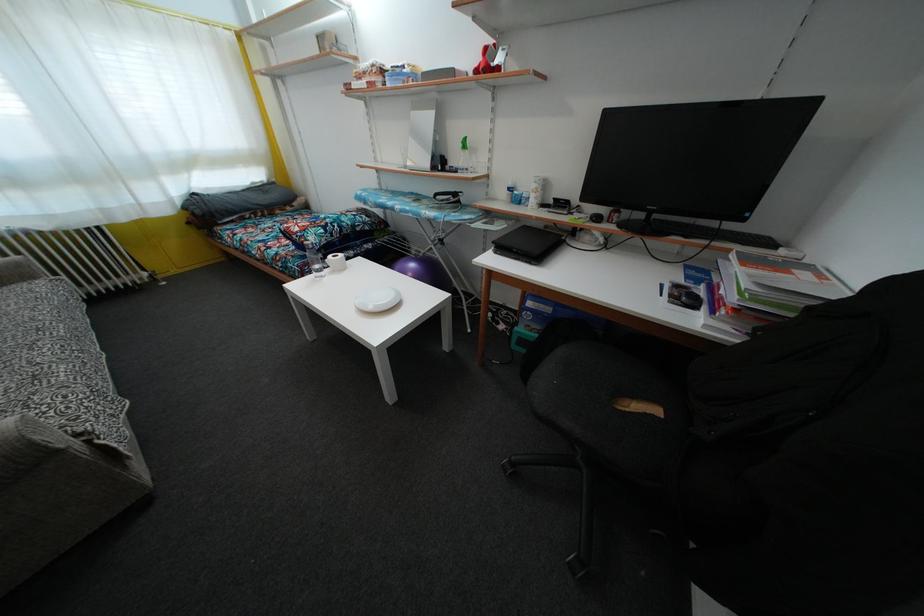
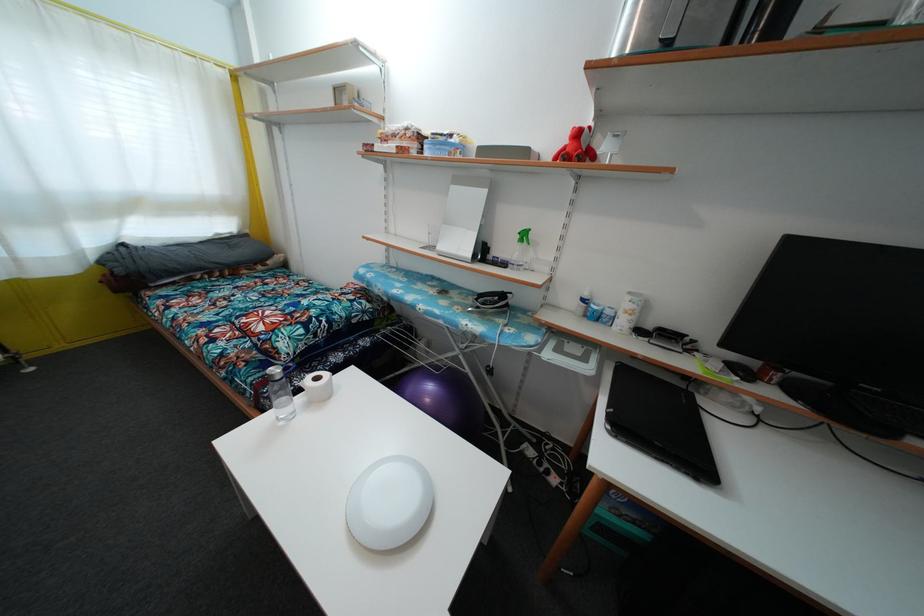
What movement of the cameraman would produce the second image?

The movement direction of the cameraman is left, forward.